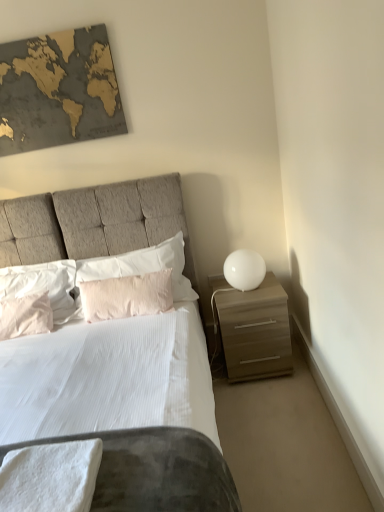
Question: Which direction should I rotate to look at white soft pillow at center, the 1th pillow in the right-to-left sequence?

Choices:
 (A) right
 (B) left

Answer: (B)

Question: Is matte brown nightstand at right outside pale pink fabric pillow at center, positioned as the second pillow in right-to-left order?

Choices:
 (A) no
 (B) yes

Answer: (B)

Question: Considering the relative sizes of matte brown nightstand at right and pale pink fabric pillow at center, which is counted as the third pillow, starting from the left, in the image provided, is matte brown nightstand at right wider than pale pink fabric pillow at center, which is counted as the third pillow, starting from the left,?

Choices:
 (A) no
 (B) yes

Answer: (B)

Question: From a real-world perspective, is matte brown nightstand at right on pale pink fabric pillow at center, which is counted as the third pillow, starting from the left?

Choices:
 (A) yes
 (B) no

Answer: (B)

Question: From the image's perspective, does matte brown nightstand at right appear lower than pale pink fabric pillow at center, which is counted as the third pillow, starting from the left?

Choices:
 (A) yes
 (B) no

Answer: (A)

Question: Is matte brown nightstand at right behind pale pink fabric pillow at center, which is counted as the third pillow, starting from the left?

Choices:
 (A) yes
 (B) no

Answer: (B)

Question: From the image's perspective, is matte brown nightstand at right on top of pale pink fabric pillow at center, which is counted as the third pillow, starting from the left?

Choices:
 (A) yes
 (B) no

Answer: (B)

Question: Is white fabric bed at center at the left side of gold textured map at upper left?

Choices:
 (A) no
 (B) yes

Answer: (A)

Question: From a real-world perspective, does white fabric bed at center stand above gold textured map at upper left?

Choices:
 (A) no
 (B) yes

Answer: (A)

Question: Is white fabric bed at center shorter than gold textured map at upper left?

Choices:
 (A) no
 (B) yes

Answer: (A)

Question: Can you confirm if white fabric bed at center is bigger than gold textured map at upper left?

Choices:
 (A) no
 (B) yes

Answer: (B)

Question: Is white fabric bed at center outside of gold textured map at upper left?

Choices:
 (A) yes
 (B) no

Answer: (A)

Question: Is white fabric bed at center taller than gold textured map at upper left?

Choices:
 (A) no
 (B) yes

Answer: (B)

Question: Is matte brown nightstand at right facing towards gold textured map at upper left?

Choices:
 (A) yes
 (B) no

Answer: (B)